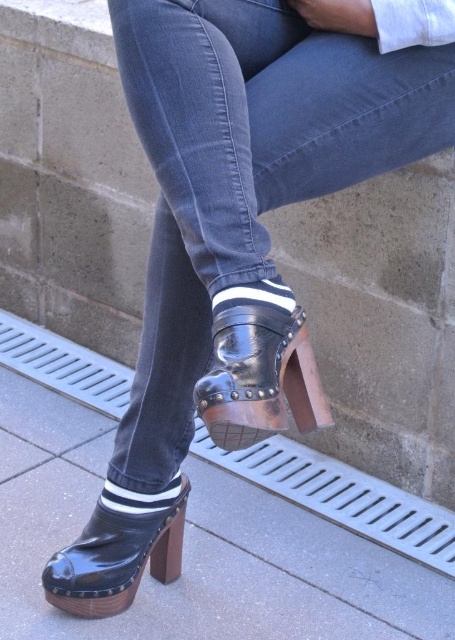
Question: Does glossy wood curb at lower center come in front of black patent leather platform shoe at lower center?

Choices:
 (A) yes
 (B) no

Answer: (B)

Question: Which point is closer to the camera?

Choices:
 (A) glossy wood curb at lower center
 (B) denim at center
 (C) shiny black sandal at center

Answer: (B)

Question: Which is farther from the glossy wood curb at lower center?

Choices:
 (A) shiny black sandal at center
 (B) denim at center

Answer: (B)

Question: Can you confirm if shiny black sandal at center is thinner than black patent leather platform shoe at lower center?

Choices:
 (A) no
 (B) yes

Answer: (B)

Question: Which object is farther from the camera taking this photo?

Choices:
 (A) shiny black sandal at center
 (B) black patent leather platform shoe at lower center
 (C) glossy wood curb at lower center

Answer: (C)

Question: Can you confirm if shiny black sandal at center is positioned to the right of black patent leather platform shoe at lower center?

Choices:
 (A) no
 (B) yes

Answer: (B)